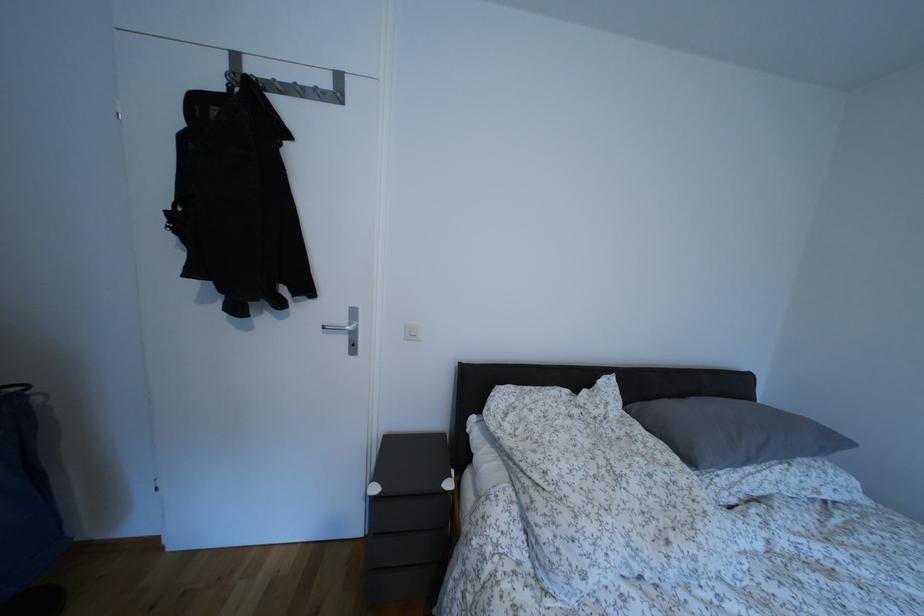
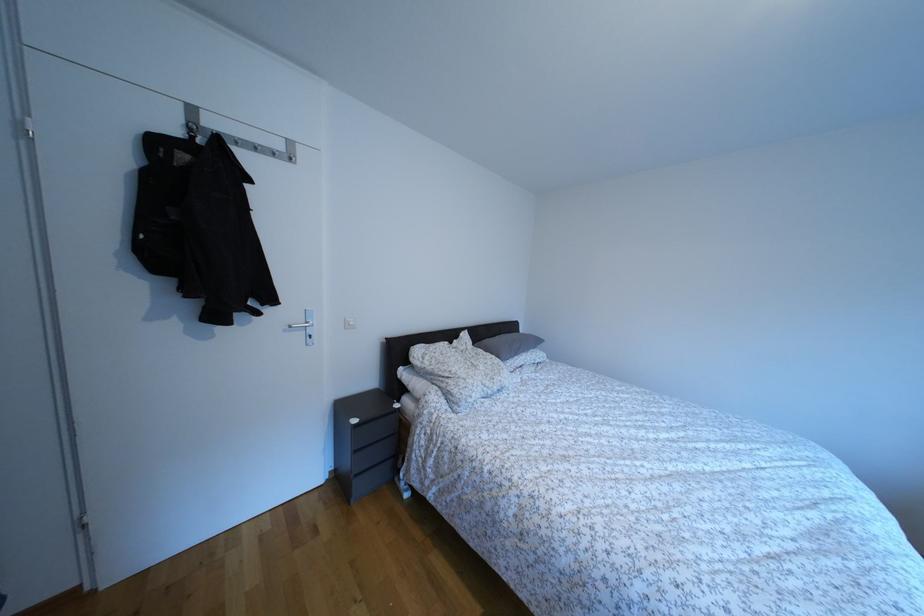
In the second image, find the point that corresponds to pixel 334 89 in the first image.

(286, 152)